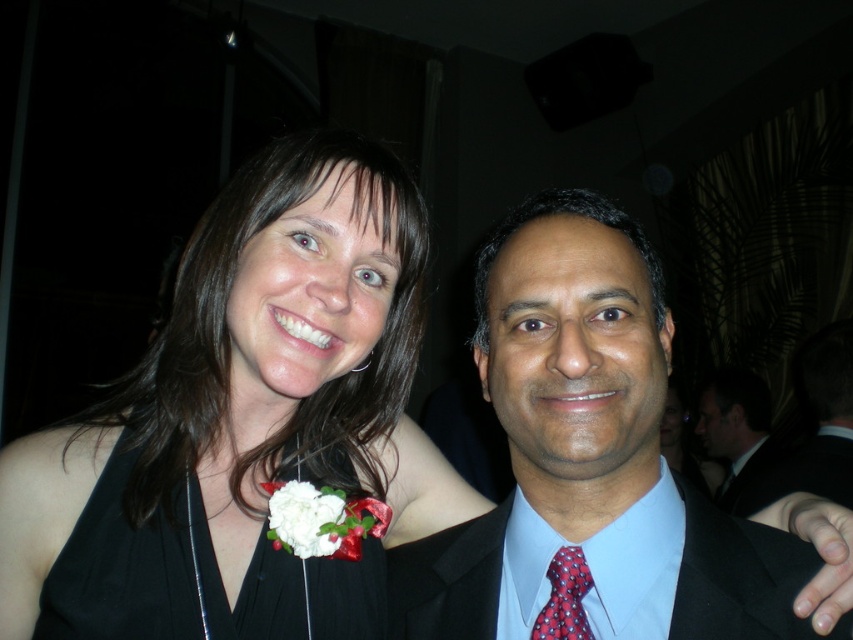
Question: Is the position of light blue satin shirt at center less distant than that of dark blue satin suit at center?

Choices:
 (A) yes
 (B) no

Answer: (A)

Question: Which of these objects is positioned farthest from the light blue satin shirt at center?

Choices:
 (A) black satin dress at center
 (B) dark blue satin suit at center
 (C) white fabric flower at center

Answer: (C)

Question: Is matte black suit at right to the right of white fabric flower at center from the viewer's perspective?

Choices:
 (A) yes
 (B) no

Answer: (A)

Question: Among these objects, which one is nearest to the camera?

Choices:
 (A) light blue satin shirt at center
 (B) black satin dress at center
 (C) red dotted tie at center

Answer: (A)

Question: Which point is closer to the camera?

Choices:
 (A) red dotted tie at center
 (B) light blue satin shirt at center
 (C) white fabric flower at center

Answer: (B)

Question: Is black satin dress at center to the left of white fabric flower at center from the viewer's perspective?

Choices:
 (A) yes
 (B) no

Answer: (A)